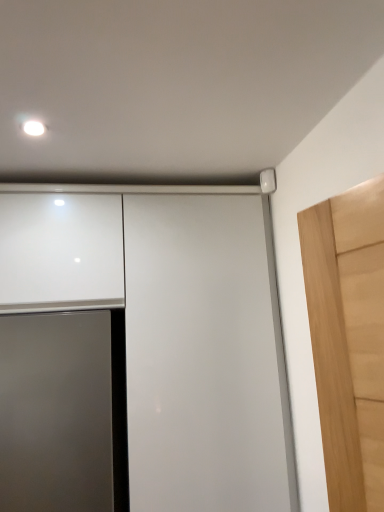
Describe the element at coordinates (205, 356) in the screenshot. I see `white glossy barn door at upper center` at that location.

The width and height of the screenshot is (384, 512). I want to click on white glossy barn door at upper center, so click(x=205, y=356).

Where is `white glossy barn door at upper center`? white glossy barn door at upper center is located at coordinates (205, 356).